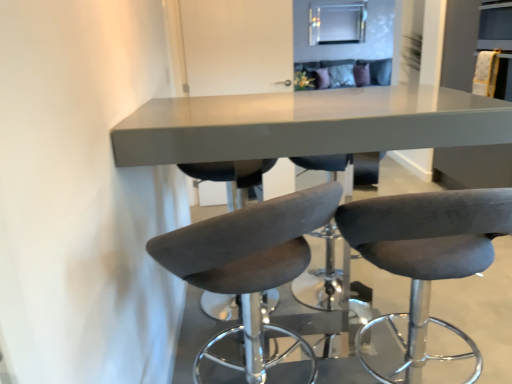
Image resolution: width=512 pixels, height=384 pixels. Describe the element at coordinates (248, 242) in the screenshot. I see `suede-like gray bar stool at center, which ranks as the 2th chair in right-to-left order` at that location.

In order to click on dark gray fabric stool at center, the 2th chair viewed from the left in this screenshot , I will do `click(428, 250)`.

Find the location of a particular element. suede-like gray bar stool at center, which ranks as the 2th chair in right-to-left order is located at coordinates (248, 242).

Considering the sizes of objects matte gray table at center and dark gray fabric stool at center, arranged as the first chair when viewed from the right, in the image provided, who is taller, matte gray table at center or dark gray fabric stool at center, arranged as the first chair when viewed from the right,?

matte gray table at center is taller.

Is matte gray table at center wider or thinner than dark gray fabric stool at center, arranged as the first chair when viewed from the right?

In the image, matte gray table at center appears to be wider than dark gray fabric stool at center, arranged as the first chair when viewed from the right.

Is matte gray table at center behind dark gray fabric stool at center, the 2th chair viewed from the left?

Yes, the depth of matte gray table at center is greater than that of dark gray fabric stool at center, the 2th chair viewed from the left.

Locate an element on the screen. Image resolution: width=512 pixels, height=384 pixels. table on the left of dark gray fabric stool at center, arranged as the first chair when viewed from the right is located at coordinates (307, 124).

Considering the sizes of objects matte gray table at center and suede-like gray bar stool at center, which ranks as the 2th chair in right-to-left order, in the image provided, who is shorter, matte gray table at center or suede-like gray bar stool at center, which ranks as the 2th chair in right-to-left order,?

suede-like gray bar stool at center, which ranks as the 2th chair in right-to-left order, is shorter.

From the image's perspective, between matte gray table at center and suede-like gray bar stool at center, which ranks as the 2th chair in right-to-left order, which one is located above?

From the image's view, matte gray table at center is above.

From a real-world perspective, which is physically above, matte gray table at center or suede-like gray bar stool at center, the 1th chair when ordered from left to right?

matte gray table at center.

Could you tell me if suede-like gray bar stool at center, which ranks as the 2th chair in right-to-left order, is facing matte gray table at center?

Yes, suede-like gray bar stool at center, which ranks as the 2th chair in right-to-left order, is facing matte gray table at center.

From the picture: Is matte gray table at center completely or partially inside suede-like gray bar stool at center, the 1th chair when ordered from left to right?

No, matte gray table at center is located outside of suede-like gray bar stool at center, the 1th chair when ordered from left to right.

Does suede-like gray bar stool at center, the 1th chair when ordered from left to right, have a larger size compared to matte gray table at center?

Actually, suede-like gray bar stool at center, the 1th chair when ordered from left to right, might be smaller than matte gray table at center.

Considering the sizes of objects suede-like gray bar stool at center, the 1th chair when ordered from left to right, and matte gray table at center in the image provided, who is shorter, suede-like gray bar stool at center, the 1th chair when ordered from left to right, or matte gray table at center?

Standing shorter between the two is suede-like gray bar stool at center, the 1th chair when ordered from left to right.

Is suede-like gray bar stool at center, the 1th chair when ordered from left to right, surrounding dark gray fabric stool at center, arranged as the first chair when viewed from the right?

No, suede-like gray bar stool at center, the 1th chair when ordered from left to right, does not contain dark gray fabric stool at center, arranged as the first chair when viewed from the right.

Considering the positions of objects suede-like gray bar stool at center, which ranks as the 2th chair in right-to-left order, and dark gray fabric stool at center, the 2th chair viewed from the left, in the image provided, who is more to the left, suede-like gray bar stool at center, which ranks as the 2th chair in right-to-left order, or dark gray fabric stool at center, the 2th chair viewed from the left,?

Positioned to the left is suede-like gray bar stool at center, which ranks as the 2th chair in right-to-left order.

Locate an element on the screen. The height and width of the screenshot is (384, 512). chair that appears behind the suede-like gray bar stool at center, which ranks as the 2th chair in right-to-left order is located at coordinates (428, 250).

Which object is further away from the camera taking this photo, dark gray fabric stool at center, the 2th chair viewed from the left, or suede-like gray bar stool at center, which ranks as the 2th chair in right-to-left order?

dark gray fabric stool at center, the 2th chair viewed from the left, is more distant.

Which object is wider, dark gray fabric stool at center, the 2th chair viewed from the left, or suede-like gray bar stool at center, which ranks as the 2th chair in right-to-left order?

With larger width is suede-like gray bar stool at center, which ranks as the 2th chair in right-to-left order.

Is dark gray fabric stool at center, the 2th chair viewed from the left, taller or shorter than suede-like gray bar stool at center, which ranks as the 2th chair in right-to-left order?

dark gray fabric stool at center, the 2th chair viewed from the left, is shorter than suede-like gray bar stool at center, which ranks as the 2th chair in right-to-left order.

From the image's perspective, which one is positioned lower, dark gray fabric stool at center, the 2th chair viewed from the left, or matte gray table at center?

dark gray fabric stool at center, the 2th chair viewed from the left.

From a real-world perspective, is dark gray fabric stool at center, arranged as the first chair when viewed from the right, positioned under matte gray table at center based on gravity?

Yes, from a real-world perspective, dark gray fabric stool at center, arranged as the first chair when viewed from the right, is under matte gray table at center.

Considering the sizes of objects dark gray fabric stool at center, the 2th chair viewed from the left, and matte gray table at center in the image provided, who is bigger, dark gray fabric stool at center, the 2th chair viewed from the left, or matte gray table at center?

matte gray table at center.

Is dark gray fabric stool at center, the 2th chair viewed from the left, in front of matte gray table at center?

Yes, dark gray fabric stool at center, the 2th chair viewed from the left, is closer to the viewer.

Find the location of `table above the dark gray fabric stool at center, arranged as the first chair when viewed from the right (from the image's perspective)`. table above the dark gray fabric stool at center, arranged as the first chair when viewed from the right (from the image's perspective) is located at coordinates (307, 124).

Locate an element on the screen. The image size is (512, 384). table that appears behind the suede-like gray bar stool at center, which ranks as the 2th chair in right-to-left order is located at coordinates (307, 124).

From the image, which object appears to be farther from matte gray table at center, dark gray fabric stool at center, the 2th chair viewed from the left, or suede-like gray bar stool at center, the 1th chair when ordered from left to right?

dark gray fabric stool at center, the 2th chair viewed from the left.

Looking at the image, which one is located closer to suede-like gray bar stool at center, the 1th chair when ordered from left to right, matte gray table at center or dark gray fabric stool at center, arranged as the first chair when viewed from the right?

matte gray table at center lies closer to suede-like gray bar stool at center, the 1th chair when ordered from left to right, than the other object.

Estimate the real-world distances between objects in this image. Which object is further from dark gray fabric stool at center, the 2th chair viewed from the left, matte gray table at center or suede-like gray bar stool at center, which ranks as the 2th chair in right-to-left order?

matte gray table at center.

From the image, which object appears to be nearer to matte gray table at center, suede-like gray bar stool at center, which ranks as the 2th chair in right-to-left order, or dark gray fabric stool at center, the 2th chair viewed from the left?

suede-like gray bar stool at center, which ranks as the 2th chair in right-to-left order, is positioned closer to the anchor matte gray table at center.

Based on their spatial positions, is dark gray fabric stool at center, arranged as the first chair when viewed from the right, or matte gray table at center closer to suede-like gray bar stool at center, the 1th chair when ordered from left to right?

matte gray table at center.

Considering their positions, is suede-like gray bar stool at center, which ranks as the 2th chair in right-to-left order, positioned closer to dark gray fabric stool at center, the 2th chair viewed from the left, than matte gray table at center?

The object closer to dark gray fabric stool at center, the 2th chair viewed from the left, is suede-like gray bar stool at center, which ranks as the 2th chair in right-to-left order.

Identify the location of table located between suede-like gray bar stool at center, which ranks as the 2th chair in right-to-left order, and dark gray fabric stool at center, arranged as the first chair when viewed from the right, in the left-right direction. (307, 124).